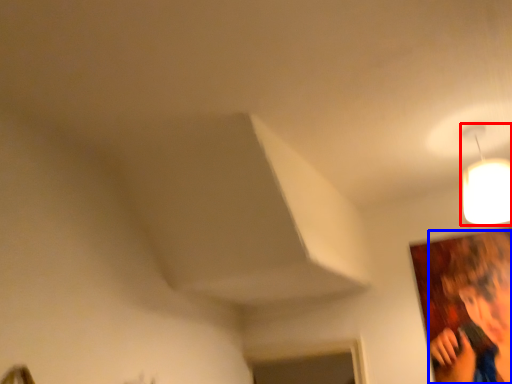
Question: Which object is further to the camera taking this photo, lamp (highlighted by a red box) or person (highlighted by a blue box)?

Choices:
 (A) lamp
 (B) person

Answer: (B)